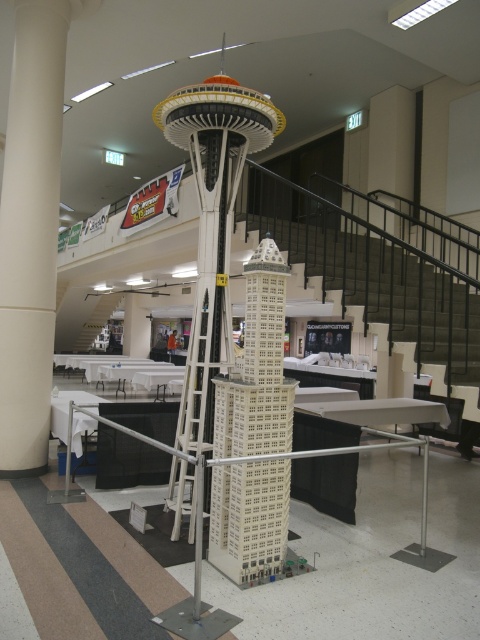
Is white smooth pillar at center positioned in front of white plastic building at center?

No, it is behind white plastic building at center.

Can you confirm if white smooth pillar at center is positioned below white plastic building at center?

No.

Identify the location of white smooth pillar at center. (31, 228).